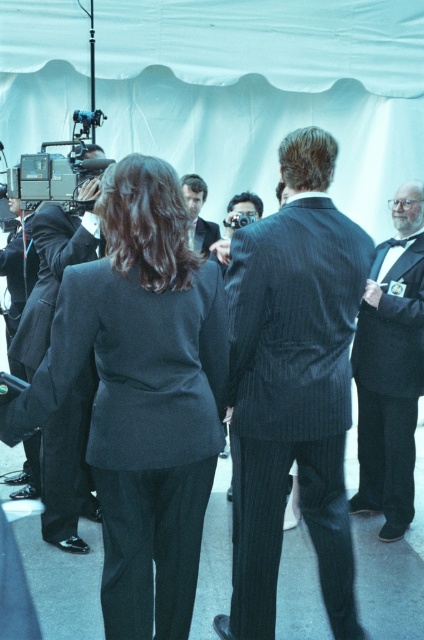
I want to click on dark pinstripe suit at center, so click(292, 387).

Is matte black suit at left positioned behind matte black suit at center?

No, matte black suit at left is in front of matte black suit at center.

Between matte black suit at left and matte black suit at center, which one is positioned higher?

matte black suit at center

I want to click on matte black suit at left, so click(x=67, y=467).

You are a GUI agent. You are given a task and a screenshot of the screen. Output one action in this format:
    pyautogui.click(x=<x>, y=<y>)
    Task: Click on the matte black tuxedo at right
    
    Given the screenshot: What is the action you would take?
    pyautogui.click(x=390, y=368)

Does matte black tuxedo at right appear over matte black suit at left?

Actually, matte black tuxedo at right is below matte black suit at left.

Who is more distant from viewer, (390,209) or (80,442)?

Positioned behind is point (390,209).

Image resolution: width=424 pixels, height=640 pixels. Identify the location of matte black tuxedo at right. (390, 368).